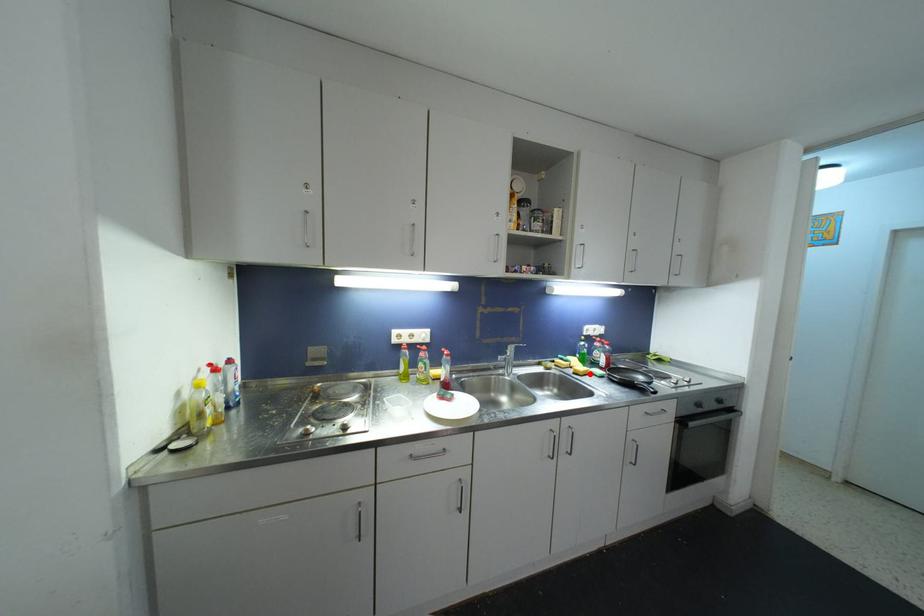
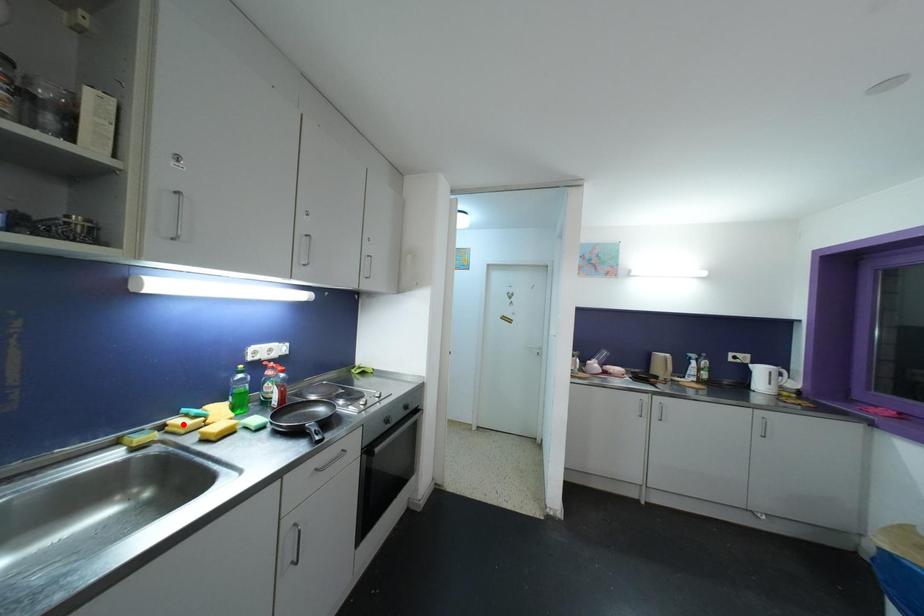
I am providing you with two images of the same scene from different viewpoints. A red point is marked on the first image and another point is marked on the second image. Does the point marked in image1 correspond to the same location as the one in image2?

No